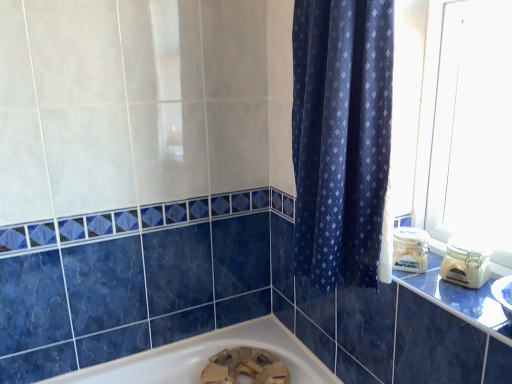
Where is `vacant region above black glossy counter top at right (from a real-world perspective)`? Image resolution: width=512 pixels, height=384 pixels. vacant region above black glossy counter top at right (from a real-world perspective) is located at coordinates pos(468,289).